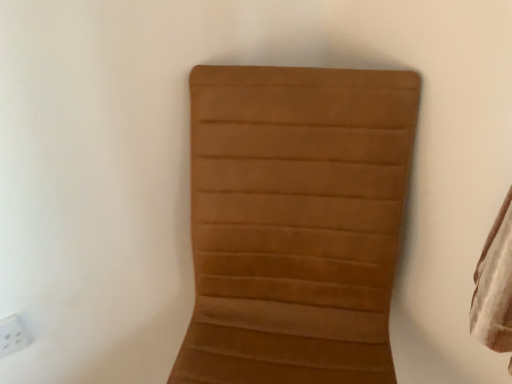
Question: Is brown suede chair at center positioned in front of white plastic electric outlet at lower left?

Choices:
 (A) yes
 (B) no

Answer: (A)

Question: Is brown suede chair at center placed right next to white plastic electric outlet at lower left?

Choices:
 (A) yes
 (B) no

Answer: (B)

Question: Is brown suede chair at center smaller than white plastic electric outlet at lower left?

Choices:
 (A) no
 (B) yes

Answer: (A)

Question: Is brown suede chair at center located outside white plastic electric outlet at lower left?

Choices:
 (A) yes
 (B) no

Answer: (A)

Question: Does brown suede chair at center have a larger size compared to white plastic electric outlet at lower left?

Choices:
 (A) yes
 (B) no

Answer: (A)

Question: Is brown suede chair at center turned away from white plastic electric outlet at lower left?

Choices:
 (A) yes
 (B) no

Answer: (B)

Question: Considering the relative sizes of white plastic electric outlet at lower left and brown suede chair at center in the image provided, is white plastic electric outlet at lower left thinner than brown suede chair at center?

Choices:
 (A) no
 (B) yes

Answer: (B)

Question: Considering the relative positions of white plastic electric outlet at lower left and brown suede chair at center in the image provided, is white plastic electric outlet at lower left to the left of brown suede chair at center from the viewer's perspective?

Choices:
 (A) no
 (B) yes

Answer: (B)

Question: Is the depth of white plastic electric outlet at lower left greater than that of brown suede chair at center?

Choices:
 (A) yes
 (B) no

Answer: (A)

Question: Would you say white plastic electric outlet at lower left is outside brown suede chair at center?

Choices:
 (A) yes
 (B) no

Answer: (A)

Question: Is there a large distance between white plastic electric outlet at lower left and brown suede chair at center?

Choices:
 (A) yes
 (B) no

Answer: (B)

Question: From the image's perspective, is white plastic electric outlet at lower left on brown suede chair at center?

Choices:
 (A) yes
 (B) no

Answer: (A)

Question: From the image's perspective, is white plastic electric outlet at lower left above or below brown suede chair at center?

Choices:
 (A) above
 (B) below

Answer: (A)